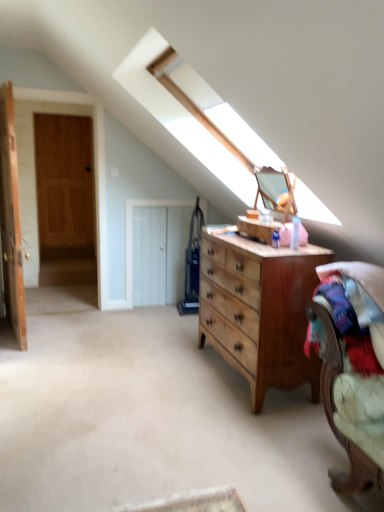
Find the location of a particular element. The image size is (384, 512). free space on the front side of wooden dresser at center is located at coordinates (241, 429).